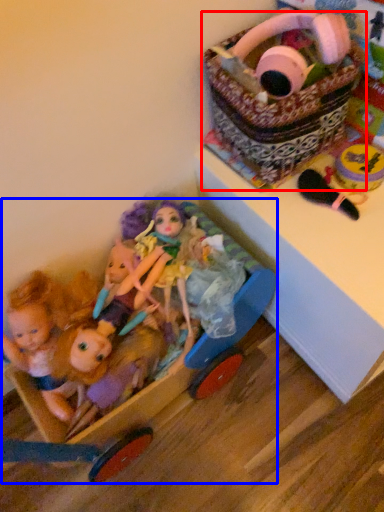
Question: Which point is further to the camera, basket (highlighted by a red box) or baby carriage (highlighted by a blue box)?

Choices:
 (A) basket
 (B) baby carriage

Answer: (A)